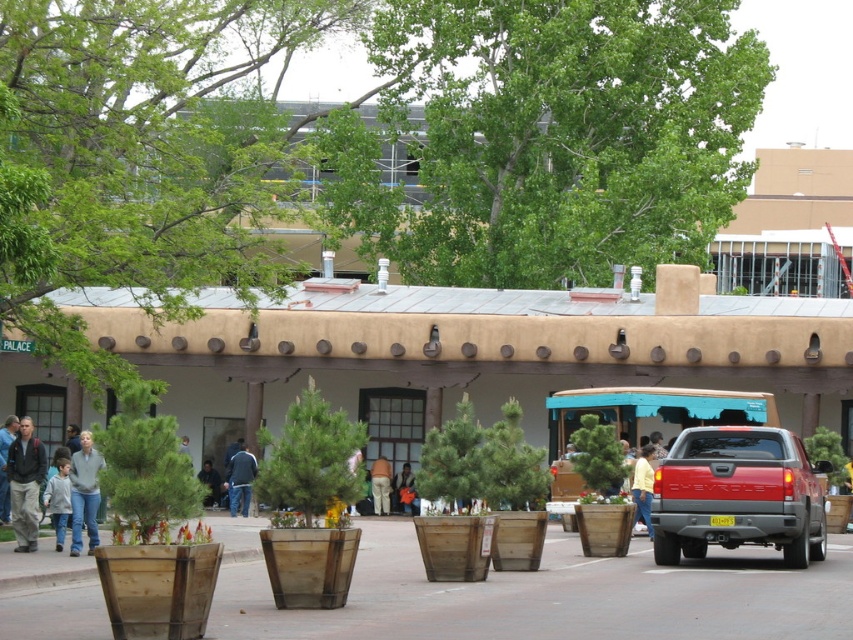
Question: Among these objects, which one is nearest to the camera?

Choices:
 (A) red matte truck at center right
 (B) orange fabric bag at center
 (C) denim jeans at lower left
 (D) yellow cotton shirt at center

Answer: (A)

Question: Does smooth concrete plaza at center have a lesser width compared to dark blue jeans at center?

Choices:
 (A) yes
 (B) no

Answer: (B)

Question: Can you confirm if dark gray jacket at left is smaller than light brown pants at center?

Choices:
 (A) yes
 (B) no

Answer: (A)

Question: Which of the following is the closest to the observer?

Choices:
 (A) (67, 500)
 (B) (410, 490)
 (C) (633, 220)

Answer: (A)

Question: Is denim jeans at lower left behind orange fabric bag at center?

Choices:
 (A) yes
 (B) no

Answer: (B)

Question: Which of the following is the farthest from the observer?

Choices:
 (A) (271, 316)
 (B) (78, 465)

Answer: (A)